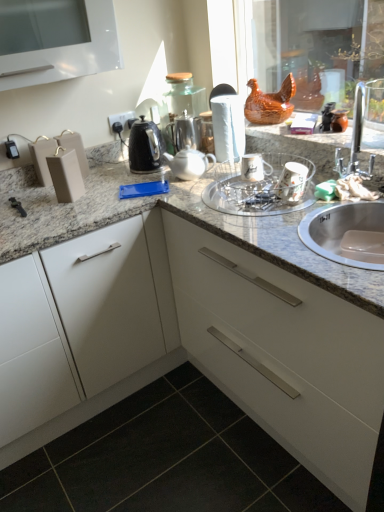
The height and width of the screenshot is (512, 384). What do you see at coordinates (348, 233) in the screenshot?
I see `silver metallic sink at right` at bounding box center [348, 233].

What do you see at coordinates (188, 163) in the screenshot?
I see `white glossy tea pot at center, which is the first tea pot in front-to-back order` at bounding box center [188, 163].

What is the approximate width of white glossy tea pot at center, which is the first tea pot in front-to-back order?

white glossy tea pot at center, which is the first tea pot in front-to-back order, is 6.17 inches in width.

Describe the element at coordinates (270, 103) in the screenshot. This screenshot has height=512, width=384. I see `brown glossy chicken at upper center` at that location.

This screenshot has width=384, height=512. Describe the element at coordinates (228, 127) in the screenshot. I see `white matte paper towel at center` at that location.

This screenshot has height=512, width=384. What do you see at coordinates (239, 319) in the screenshot?
I see `granite at center` at bounding box center [239, 319].

Where is `black tile at lower left`? black tile at lower left is located at coordinates (165, 459).

From a real-world perspective, is white glossy tea pot at center, which is the first tea pot in front-to-back order, physically above satin silver teapot at center, which is the 1th tea pot in back-to-front order?

No.

From the image's perspective, is white glossy tea pot at center, which is the first tea pot in front-to-back order, under satin silver teapot at center, which is the 1th tea pot in back-to-front order?

Indeed, from the image's perspective, white glossy tea pot at center, which is the first tea pot in front-to-back order, is shown beneath satin silver teapot at center, which is the 1th tea pot in back-to-front order.

Which is more distant, (187, 163) or (173, 153)?

Positioned behind is point (173, 153).

Does white glossy tea pot at center, acting as the 2th tea pot starting from the back, have a lesser height compared to satin silver teapot at center, positioned as the second tea pot in front-to-back order?

Indeed, white glossy tea pot at center, acting as the 2th tea pot starting from the back, has a lesser height compared to satin silver teapot at center, positioned as the second tea pot in front-to-back order.

Is clear glass bowl at center in front of silver metallic sink at right?

No, it is behind silver metallic sink at right.

Can you confirm if clear glass bowl at center is positioned to the left of silver metallic sink at right?

Yes, clear glass bowl at center is to the left of silver metallic sink at right.

From the picture: Is silver metallic sink at right inside clear glass bowl at center?

No, silver metallic sink at right is not a part of clear glass bowl at center.

Is clear glass bowl at center beside silver metallic sink at right?

There is a gap between clear glass bowl at center and silver metallic sink at right.

From a real-world perspective, between white matte paper towel at center and white glossy tea pot at center, acting as the 2th tea pot starting from the back, who is vertically higher?

white matte paper towel at center is physically above.

Which is behind, white matte paper towel at center or white glossy tea pot at center, acting as the 2th tea pot starting from the back?

white matte paper towel at center.

Is white matte paper towel at center not near white glossy tea pot at center, which is the first tea pot in front-to-back order?

No, white matte paper towel at center is not far from white glossy tea pot at center, which is the first tea pot in front-to-back order.

How many degrees apart are the facing directions of white matte paper towel at center and white glossy tea pot at center, which is the first tea pot in front-to-back order?

The facing directions of white matte paper towel at center and white glossy tea pot at center, which is the first tea pot in front-to-back order, are 3 degrees apart.

Does satin silver teapot at center, positioned as the second tea pot in front-to-back order, have a greater width compared to black tile at lower left?

In fact, satin silver teapot at center, positioned as the second tea pot in front-to-back order, might be narrower than black tile at lower left.

Is satin silver teapot at center, which is the 1th tea pot in back-to-front order, to the left of black tile at lower left from the viewer's perspective?

No.

Is satin silver teapot at center, which is the 1th tea pot in back-to-front order, situated inside black tile at lower left or outside?

satin silver teapot at center, which is the 1th tea pot in back-to-front order, is spatially situated outside black tile at lower left.

How far apart are granite at center and silver metallic sink at right?

granite at center and silver metallic sink at right are 20.28 inches apart.

Is granite at center placed right next to silver metallic sink at right?

No, granite at center is not beside silver metallic sink at right.

This screenshot has height=512, width=384. I want to click on sink that appears behind the granite at center, so click(x=348, y=233).

Looking at their sizes, would you say granite at center is wider or thinner than silver metallic sink at right?

In the image, granite at center appears to be wider than silver metallic sink at right.

Considering the sizes of objects clear glass bowl at center and brown glossy chicken at upper center in the image provided, who is bigger, clear glass bowl at center or brown glossy chicken at upper center?

clear glass bowl at center.

What are the coordinates of `chicken above the clear glass bowl at center (from a real-world perspective)` in the screenshot? It's located at (270, 103).

Is clear glass bowl at center wider or thinner than brown glossy chicken at upper center?

clear glass bowl at center is wider than brown glossy chicken at upper center.

Considering the relative positions of granite at center and white glossy tea pot at center, acting as the 2th tea pot starting from the back, in the image provided, is granite at center to the right of white glossy tea pot at center, acting as the 2th tea pot starting from the back, from the viewer's perspective?

No.

Consider the image. Would you say white glossy tea pot at center, acting as the 2th tea pot starting from the back, is part of granite at center's contents?

Absolutely, white glossy tea pot at center, acting as the 2th tea pot starting from the back, is inside granite at center.

Between granite at center and white glossy tea pot at center, which is the first tea pot in front-to-back order, which one has smaller width?

With smaller width is white glossy tea pot at center, which is the first tea pot in front-to-back order.

This screenshot has width=384, height=512. Identify the location of tea pot located on the right of white glossy tea pot at center, which is the first tea pot in front-to-back order. (183, 133).

This screenshot has width=384, height=512. In the image, there is a silver metallic sink at right. What are the coordinates of `glass bowl below it (from a real-world perspective)` in the screenshot? It's located at (258, 190).

Considering their positions, is white matte paper towel at center positioned closer to granite at center than silver metallic sink at right?

Based on the image, silver metallic sink at right appears to be nearer to granite at center.

From the image, which object appears to be farther from satin silver teapot at center, positioned as the second tea pot in front-to-back order, granite at center or white glossy tea pot at center, acting as the 2th tea pot starting from the back?

granite at center is positioned further to the anchor satin silver teapot at center, positioned as the second tea pot in front-to-back order.

From the image, which object appears to be farther from satin silver teapot at center, which is the 1th tea pot in back-to-front order, clear glass bowl at center or white matte paper towel at center?

clear glass bowl at center lies further to satin silver teapot at center, which is the 1th tea pot in back-to-front order, than the other object.

Based on their spatial positions, is brown glossy chicken at upper center or clear glass bowl at center closer to satin silver teapot at center, positioned as the second tea pot in front-to-back order?

Based on the image, brown glossy chicken at upper center appears to be nearer to satin silver teapot at center, positioned as the second tea pot in front-to-back order.

From the image, which object appears to be nearer to white glossy tea pot at center, which is the first tea pot in front-to-back order, satin silver teapot at center, which is the 1th tea pot in back-to-front order, or clear glass bowl at center?

satin silver teapot at center, which is the 1th tea pot in back-to-front order, lies closer to white glossy tea pot at center, which is the first tea pot in front-to-back order, than the other object.

From the image, which object appears to be farther from clear glass bowl at center, satin silver teapot at center, positioned as the second tea pot in front-to-back order, or white glossy tea pot at center, which is the first tea pot in front-to-back order?

satin silver teapot at center, positioned as the second tea pot in front-to-back order, is positioned further to the anchor clear glass bowl at center.

Considering their positions, is white matte paper towel at center positioned closer to silver metallic sink at right than clear glass bowl at center?

Based on the image, clear glass bowl at center appears to be nearer to silver metallic sink at right.

Which object lies nearer to the anchor point brown glossy chicken at upper center, white matte paper towel at center or white glossy tea pot at center, acting as the 2th tea pot starting from the back?

Based on the image, white matte paper towel at center appears to be nearer to brown glossy chicken at upper center.

At what (x,y) coordinates should I click in order to perform the action: click on countertop that lies between silver metallic sink at right and black tile at lower left from top to bottom. Please return your answer as a coordinate pair (x, y). The image size is (384, 512). Looking at the image, I should click on (239, 319).

You are a GUI agent. You are given a task and a screenshot of the screen. Output one action in this format:
    pyautogui.click(x=<x>, y=<y>)
    Task: Click on the paper towel between granite at center and satin silver teapot at center, positioned as the second tea pot in front-to-back order, from front to back
    The image size is (384, 512).
    Given the screenshot: What is the action you would take?
    pyautogui.click(x=228, y=127)

At what (x,y) coordinates should I click in order to perform the action: click on paper towel between clear glass bowl at center and satin silver teapot at center, positioned as the second tea pot in front-to-back order, from front to back. Please return your answer as a coordinate pair (x, y). This screenshot has width=384, height=512. Looking at the image, I should click on pos(228,127).

Where is `sink between granite at center and clear glass bowl at center in the front-back direction`? This screenshot has width=384, height=512. sink between granite at center and clear glass bowl at center in the front-back direction is located at coordinates click(348, 233).